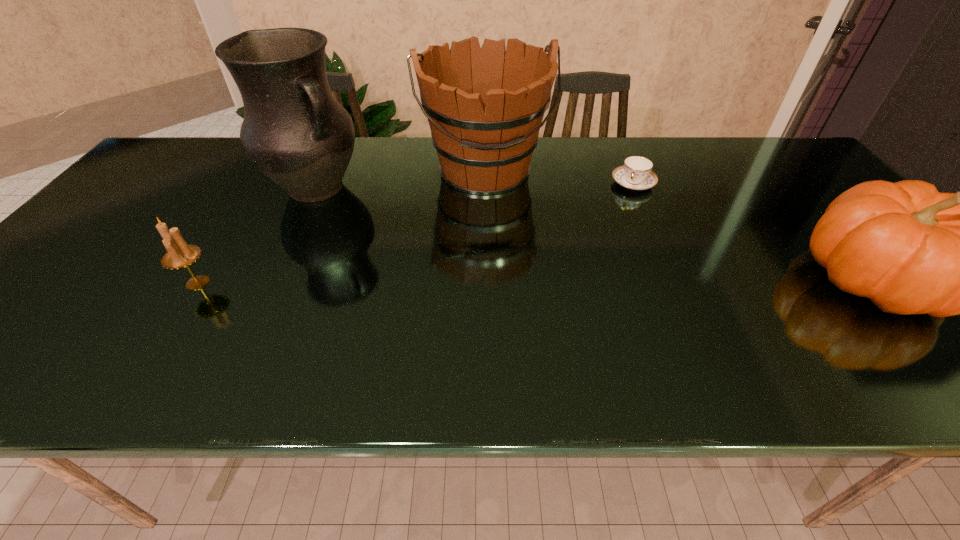
Where is `vacant region between the second object from right to left and the fourth tallest object`? vacant region between the second object from right to left and the fourth tallest object is located at coordinates (416, 233).

Where is `vacant point located between the second shortest object and the pitcher`? The height and width of the screenshot is (540, 960). vacant point located between the second shortest object and the pitcher is located at coordinates (256, 235).

Identify the location of empty location between the pitcher and the third object from left to right. (400, 179).

Locate an element on the screen. empty space between the candle holder and the fourth object from left to right is located at coordinates (416, 233).

Locate an element on the screen. The width and height of the screenshot is (960, 540). the second closest object to the third object from right to left is located at coordinates (635, 174).

Select which object appears as the second closest to the third object from right to left. Please provide its 2D coordinates. Your answer should be formatted as a tuple, i.e. [(x, y)], where the tuple contains the x and y coordinates of a point satisfying the conditions above.

[(635, 174)]

The height and width of the screenshot is (540, 960). I want to click on vacant point that satisfies the following two spatial constraints: 1. on the front side of the wine bucket; 2. on the right side of the teacup, so click(485, 184).

In order to click on vacant position in the image that satisfies the following two spatial constraints: 1. on the back side of the wine bucket; 2. on the right side of the pitcher in this screenshot , I will do `click(324, 171)`.